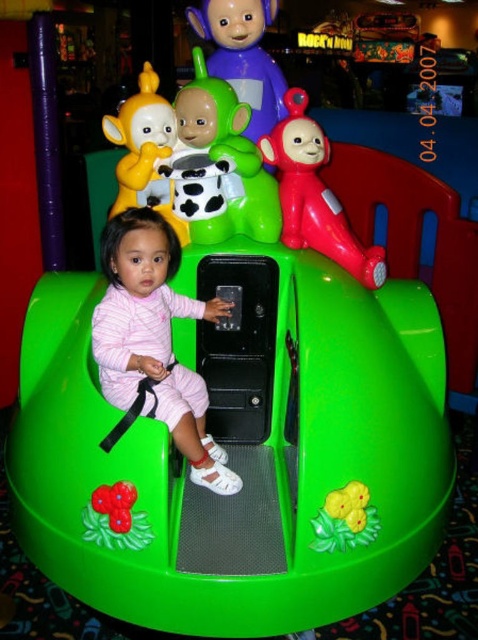
Question: Which object is the closest to the rubberized green flower at lower left?

Choices:
 (A) cow print plastic cup at upper center
 (B) rubberized red teletubbie at center
 (C) purple matte teletubby at upper center
 (D) pink cotton onesie at center

Answer: (D)

Question: Is matte yellow plush toy at upper left to the left of rubberized green flower at lower left from the viewer's perspective?

Choices:
 (A) no
 (B) yes

Answer: (B)

Question: Is purple matte teletubby at upper center to the left of matte yellow plush toy at upper left from the viewer's perspective?

Choices:
 (A) yes
 (B) no

Answer: (B)

Question: Which object is the closest to the rubberized red teletubbie at center?

Choices:
 (A) purple matte teletubby at upper center
 (B) pink cotton onesie at center

Answer: (A)

Question: Among these points, which one is farthest from the camera?

Choices:
 (A) (120, 346)
 (B) (125, 196)

Answer: (B)

Question: In this image, where is cow print plastic cup at upper center located relative to matte yellow plush toy at upper left?

Choices:
 (A) below
 (B) above

Answer: (B)